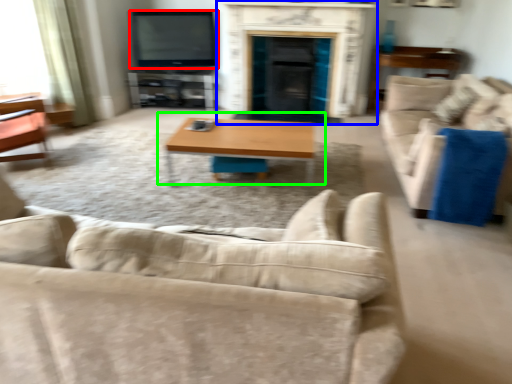
Question: Considering the real-world distances, which object is farthest from television (highlighted by a red box)? fireplace (highlighted by a blue box) or coffee table (highlighted by a green box)?

Choices:
 (A) fireplace
 (B) coffee table

Answer: (B)